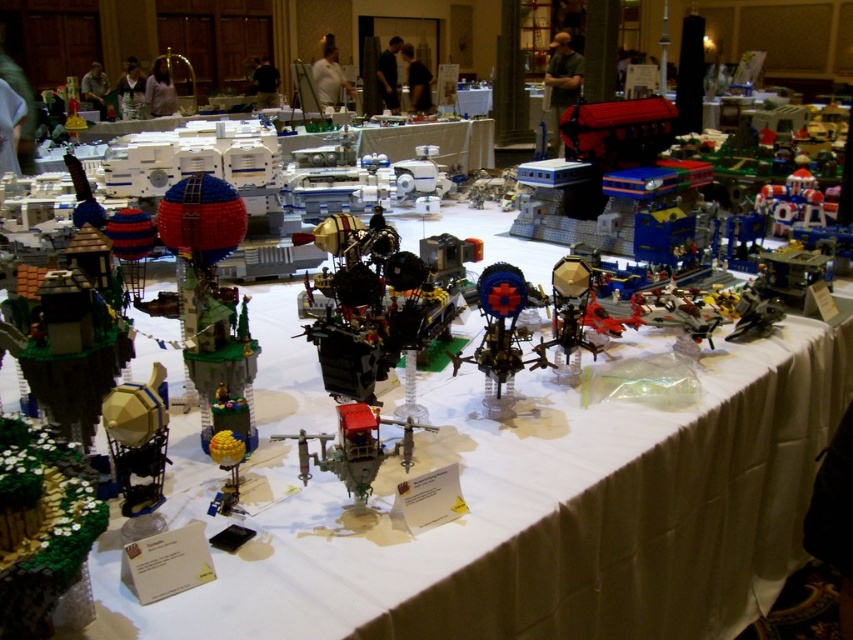
You are a LEGO designer observing the display. You need to place a new LEGO model that requires a space wider than the green grassy tree at lower left. Can the metallic gold sphere at center provide enough space for this?

The green grassy tree at lower left is narrower than the metallic gold sphere at center, so the metallic gold sphere at center has sufficient width to accommodate the new LEGO model requiring more space than the tree.

You are a LEGO enthusiast observing the display. You notice the green grassy tree at lower left and the metallic blue sphere at center. Which object takes up more space in the scene?

The green grassy tree at lower left is larger in size than the metallic blue sphere at center, so it takes up more space in the scene.